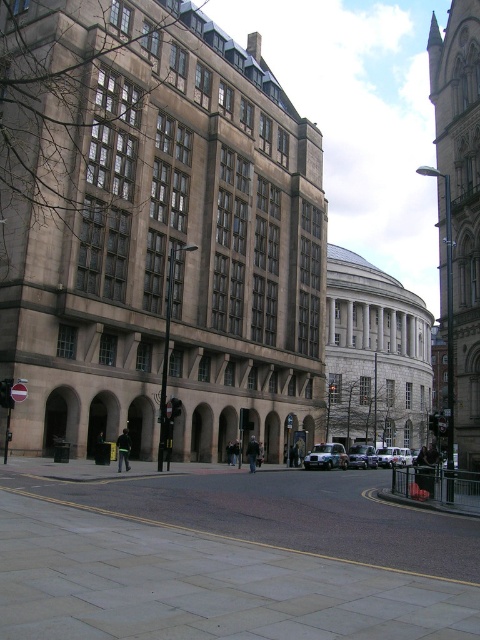
Question: Which object is the closest to the silver metallic car at center?

Choices:
 (A) metallic silver car at center
 (B) white matte van at center

Answer: (B)

Question: Can you confirm if metallic silver car at center is positioned below white matte van at center?

Choices:
 (A) yes
 (B) no

Answer: (B)

Question: Based on their relative distances, which object is nearer to the metallic silver car at center?

Choices:
 (A) silver metallic car at center
 (B) white matte van at center

Answer: (A)

Question: Estimate the real-world distances between objects in this image. Which object is farther from the silver metallic car at center?

Choices:
 (A) white matte van at center
 (B) metallic silver car at center

Answer: (B)

Question: Can you confirm if white matte van at center is wider than silver metallic car at center?

Choices:
 (A) no
 (B) yes

Answer: (B)

Question: Does white matte van at center appear on the left side of silver metallic car at center?

Choices:
 (A) no
 (B) yes

Answer: (A)